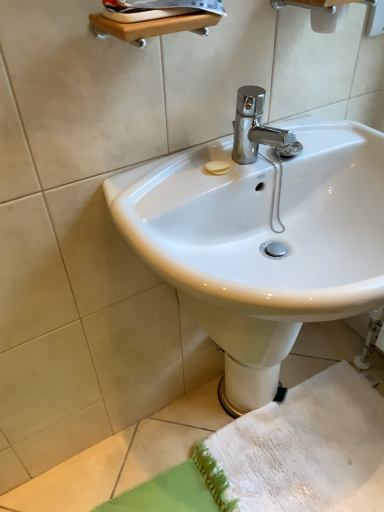
Question: From their relative heights in the image, would you say white glossy sink at center is taller or shorter than white textured towel at lower right?

Choices:
 (A) tall
 (B) short

Answer: (A)

Question: Is white glossy sink at center situated inside white textured towel at lower right or outside?

Choices:
 (A) inside
 (B) outside

Answer: (B)

Question: Considering the real-world distances, which object is closest to the white glossy bidet at lower center?

Choices:
 (A) white glossy sink at center
 (B) white textured towel at lower right

Answer: (A)

Question: Based on their relative distances, which object is nearer to the white textured towel at lower right?

Choices:
 (A) white glossy bidet at lower center
 (B) white glossy sink at center

Answer: (A)